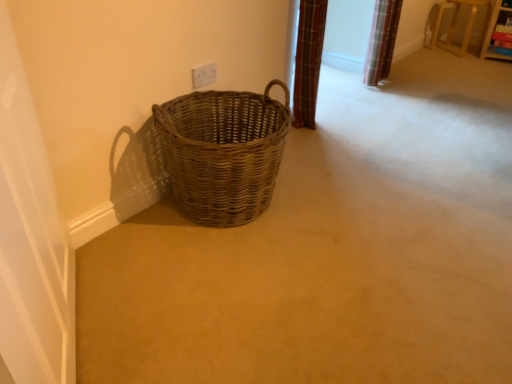
Question: From a real-world perspective, relative to woven brown basket at lower left, is white plastic electric outlet at upper center vertically above or below?

Choices:
 (A) below
 (B) above

Answer: (B)

Question: Looking at their shapes, would you say white plastic electric outlet at upper center is wider or thinner than woven brown basket at lower left?

Choices:
 (A) thin
 (B) wide

Answer: (A)

Question: Considering the real-world distances, which object is closest to the white glossy screen door at left?

Choices:
 (A) woven brown basket at lower left
 (B) white plastic electric outlet at upper center

Answer: (A)

Question: Estimate the real-world distances between objects in this image. Which object is farther from the woven brown basket at lower left?

Choices:
 (A) white glossy screen door at left
 (B) white plastic electric outlet at upper center

Answer: (A)